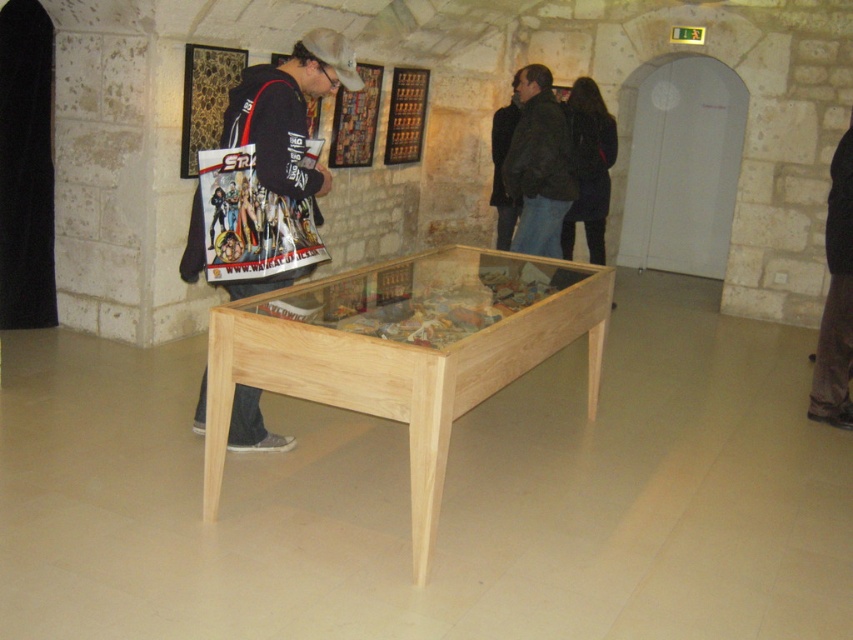
What do you see at coordinates (289, 109) in the screenshot? I see `matte black jacket at center` at bounding box center [289, 109].

The height and width of the screenshot is (640, 853). Identify the location of matte black jacket at center. (289, 109).

Is natural wood table at center thinner than matte black jacket at center?

No, natural wood table at center is not thinner than matte black jacket at center.

You are a GUI agent. You are given a task and a screenshot of the screen. Output one action in this format:
    pyautogui.click(x=<x>, y=<y>)
    Task: Click on the natural wood table at center
    The width and height of the screenshot is (853, 640).
    Given the screenshot: What is the action you would take?
    pyautogui.click(x=405, y=349)

Where is `natural wood table at center`? This screenshot has width=853, height=640. natural wood table at center is located at coordinates (405, 349).

Is dark green jacket at center below brown fabric pants at right?

Actually, dark green jacket at center is above brown fabric pants at right.

Is dark green jacket at center above brown fabric pants at right?

Yes, dark green jacket at center is above brown fabric pants at right.

Which is in front, point (544, 234) or point (851, 200)?

Point (851, 200)

Locate an element on the screen. This screenshot has height=640, width=853. dark green jacket at center is located at coordinates (538, 164).